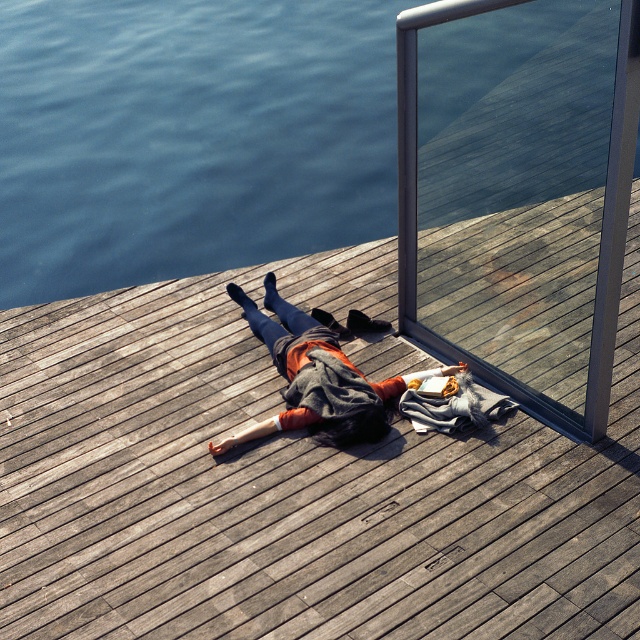
Question: Estimate the real-world distances between objects in this image. Which object is closer to the brushed metal rail at upper right?

Choices:
 (A) wooden dock at center
 (B) orange sweater at center
 (C) blue water at upper left

Answer: (B)

Question: Can you confirm if wooden dock at center is positioned to the right of blue water at upper left?

Choices:
 (A) yes
 (B) no

Answer: (A)

Question: Is blue water at upper left below orange sweater at center?

Choices:
 (A) no
 (B) yes

Answer: (A)

Question: Which point is farther from the camera taking this photo?

Choices:
 (A) (380, 394)
 (B) (323, 268)
 (C) (84, 58)

Answer: (C)

Question: Which point is farther from the camera taking this photo?

Choices:
 (A) (144, 208)
 (B) (518, 218)
 (C) (99, 524)
 (D) (308, 353)

Answer: (A)

Question: Does brushed metal rail at upper right appear under orange sweater at center?

Choices:
 (A) no
 (B) yes

Answer: (A)